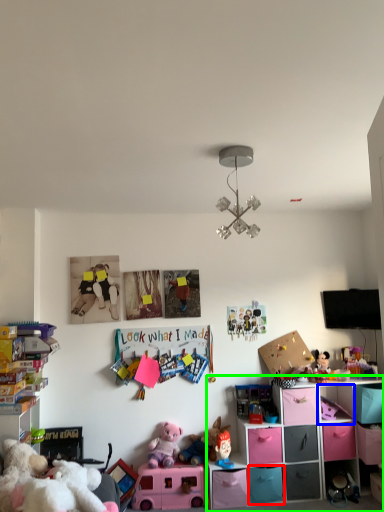
Question: Based on their relative distances, which object is farther from drawer (highlighted by a red box)? Choose from cabinet (highlighted by a blue box) and shelf (highlighted by a green box).

Choices:
 (A) cabinet
 (B) shelf

Answer: (A)